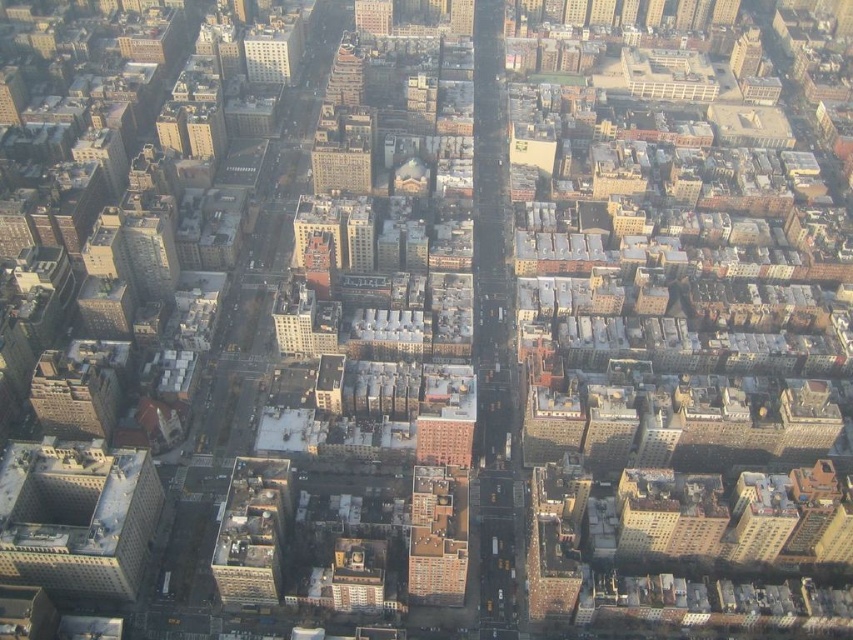
You are a drone operator who needs to deliver a package from the gray concrete building at lower left to the matte gray building at center. The drone has a maximum range of 60 meters. Can the drone complete the delivery without needing to recharge?

The gray concrete building at lower left is 63.83 meters away from the matte gray building at center. Since the drone has a maximum range of 60 meters, it cannot complete the delivery without needing to recharge because the distance exceeds its capability.

You are a drone operator trying to navigate between two buildings in the city. You need to fly from the matte gray building at upper center to the brown brick building at center. Which direction should you fly to reach your destination?

The brown brick building at center is to the right of the matte gray building at upper center, so you should fly to the right to reach it.

You are a city planner analyzing a map of the urban area. You need to determine which building has a greater width between the gray concrete building at lower left and the matte gray building at center. Which one is wider?

The gray concrete building at lower left is wider than the matte gray building at center according to the description.